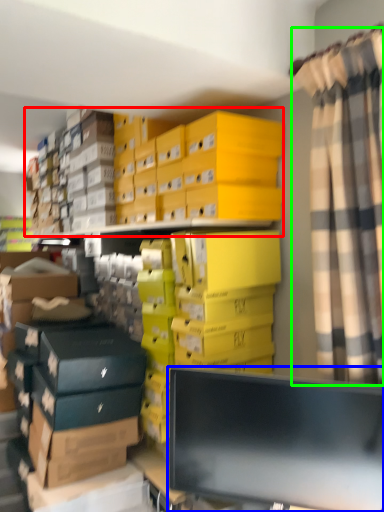
Question: Which object is positioned closest to storage box (highlighted by a red box)? Select from computer monitor (highlighted by a blue box) and curtain (highlighted by a green box).

Choices:
 (A) computer monitor
 (B) curtain

Answer: (B)